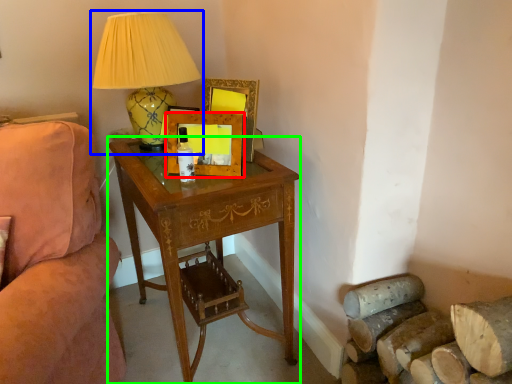
Question: Which object is positioned farthest from picture frame (highlighted by a red box)? Select from lamp (highlighted by a blue box) and desk (highlighted by a green box).

Choices:
 (A) lamp
 (B) desk

Answer: (B)